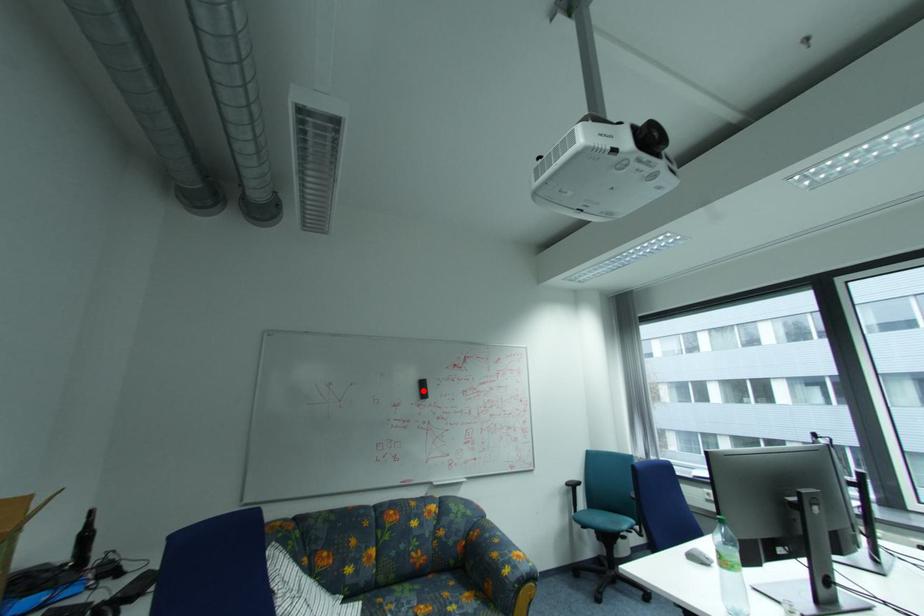
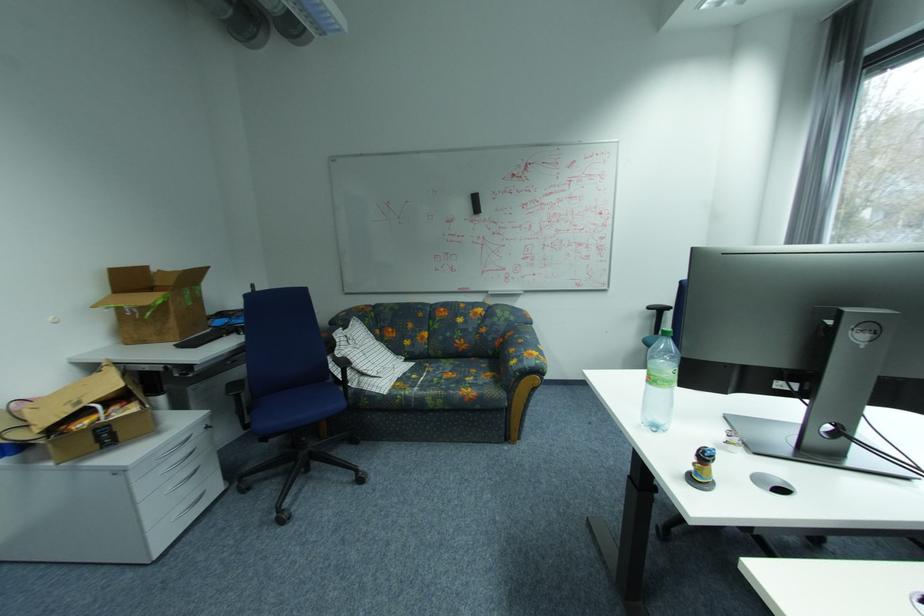
Question: I am providing you with two images of the same scene from different viewpoints. Image1 has a red point marked. In image2, the corresponding 3D location appears at what relative position? Reply with the corresponding letter.

Choices:
 (A) Closer
 (B) Farther

Answer: (A)